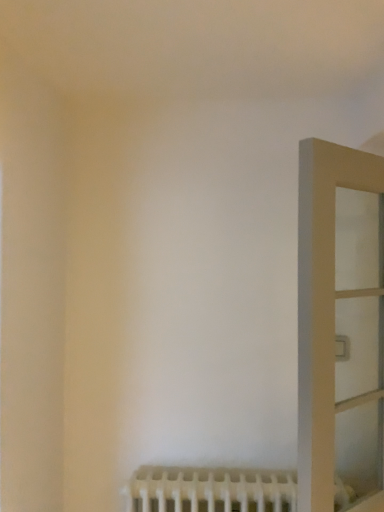
You are a GUI agent. You are given a task and a screenshot of the screen. Output one action in this format:
    pyautogui.click(x=<x>, y=<y>)
    Task: Click on the light wood door at right
    The width and height of the screenshot is (384, 512).
    Given the screenshot: What is the action you would take?
    pyautogui.click(x=340, y=326)

The height and width of the screenshot is (512, 384). What do you see at coordinates (340, 326) in the screenshot?
I see `light wood door at right` at bounding box center [340, 326].

Locate an element on the screen. This screenshot has width=384, height=512. light wood door at right is located at coordinates (340, 326).